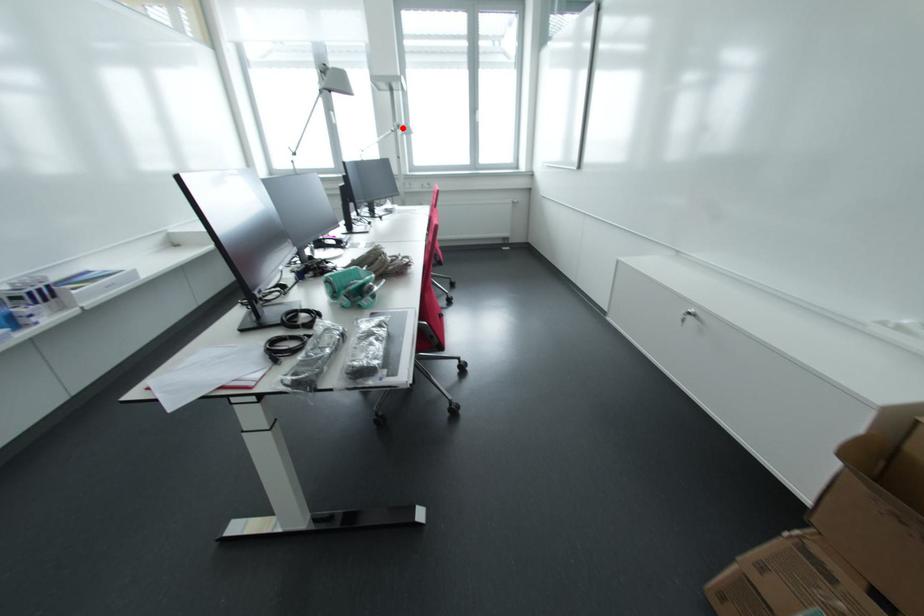
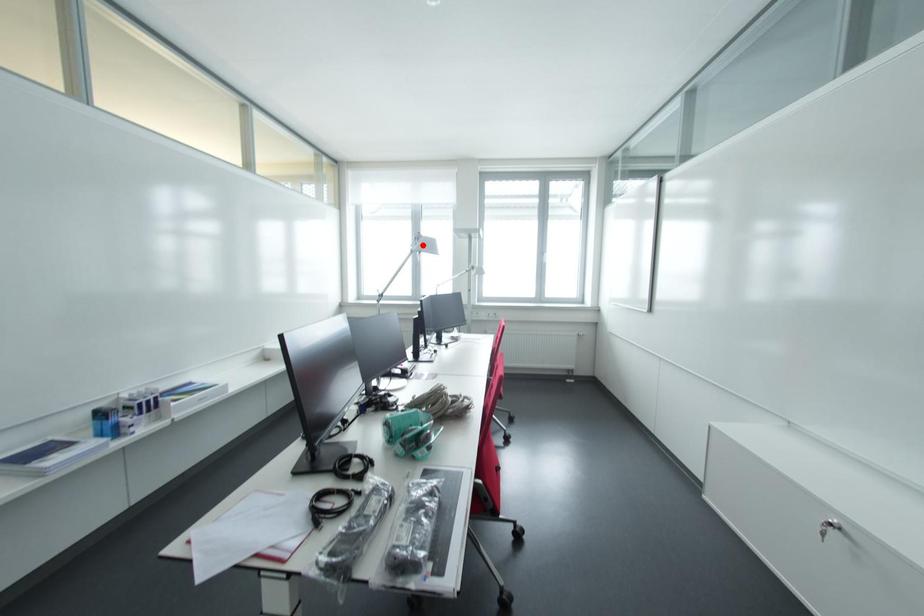
I am providing you with two images of the same scene from different viewpoints. A red point is marked on the first image and another point is marked on the second image. Does the point marked in image1 correspond to the same location as the one in image2?

No